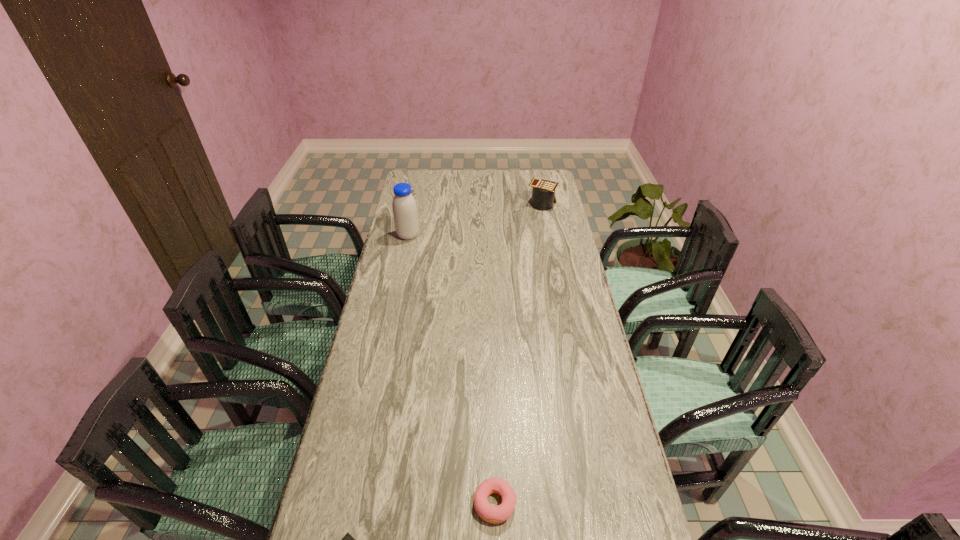
The width and height of the screenshot is (960, 540). Identify the location of object located in the right edge section of the desktop. (543, 193).

Identify the location of free region at the far edge. (511, 181).

At what (x,y) coordinates should I click in order to perform the action: click on free space at the left edge of the desktop. Please return your answer as a coordinate pair (x, y). The image size is (960, 540). Looking at the image, I should click on click(362, 420).

This screenshot has width=960, height=540. What are the coordinates of `vacant space at the right edge` in the screenshot? It's located at (x=530, y=195).

The width and height of the screenshot is (960, 540). Identify the location of vacant space at the far right corner. (526, 181).

Identify the location of free area in between the farther calculator and the second nearest object. The height and width of the screenshot is (540, 960). (518, 353).

Where is `blank region between the tallest object and the doughnut`? blank region between the tallest object and the doughnut is located at coordinates (451, 369).

You are a GUI agent. You are given a task and a screenshot of the screen. Output one action in this format:
    pyautogui.click(x=<x>, y=<y>)
    Task: Click on the free point between the tallest object and the third shortest object
    Image resolution: width=960 pixels, height=540 pixels.
    Given the screenshot: What is the action you would take?
    [475, 219]

I want to click on vacant point located between the farther calculator and the tallest object, so click(475, 219).

Find the location of a particular element. free area in between the tallest object and the right calculator is located at coordinates (475, 219).